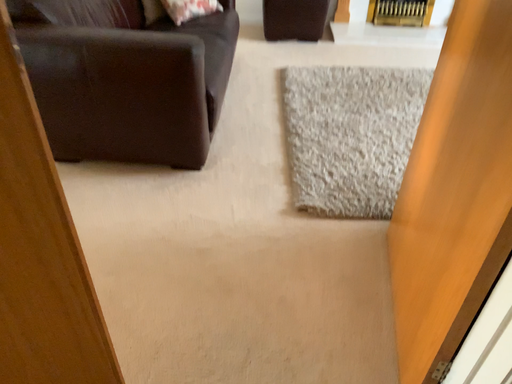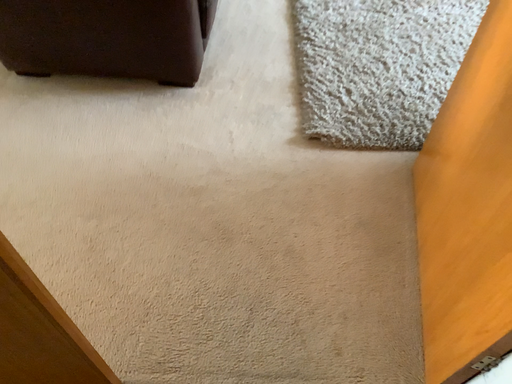
Question: How did the camera likely rotate when shooting the video?

Choices:
 (A) rotated downward
 (B) rotated upward

Answer: (A)